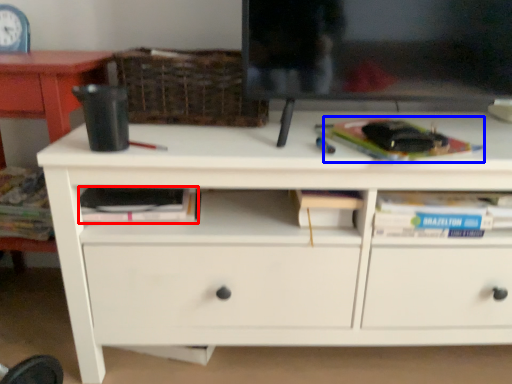
Question: Which point is closer to the camera, paperback book (highlighted by a red box) or paperback book (highlighted by a blue box)?

Choices:
 (A) paperback book
 (B) paperback book

Answer: (B)